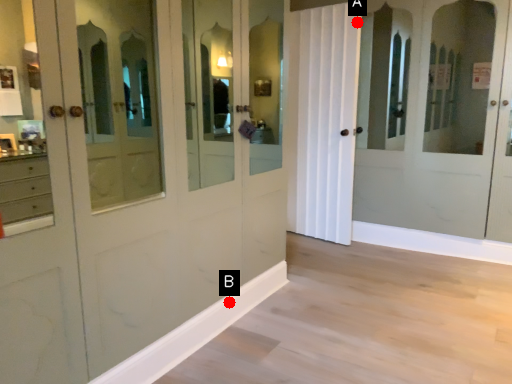
Question: Two points are circled on the image, labeled by A and B beside each circle. Which point appears closest to the camera in this image?

Choices:
 (A) A is closer
 (B) B is closer

Answer: (B)